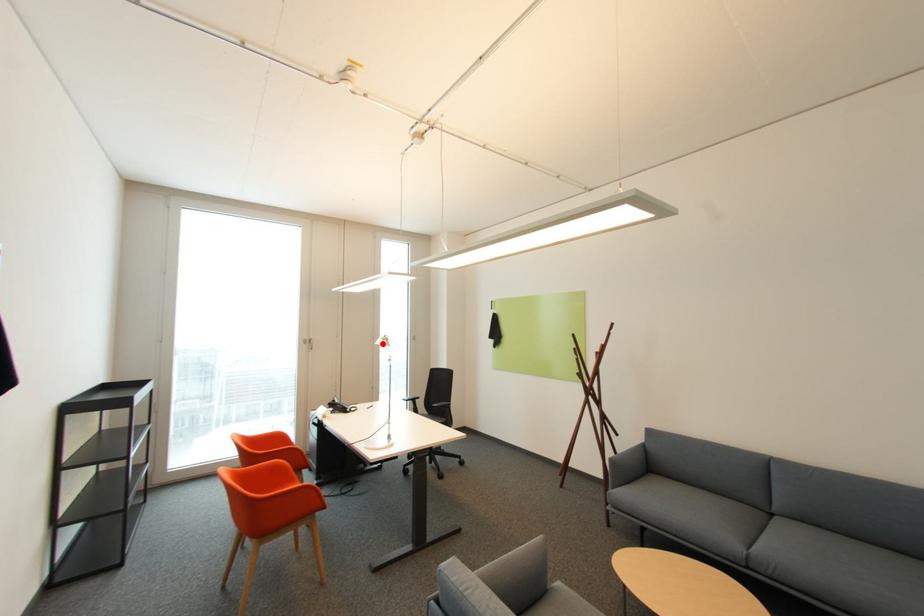
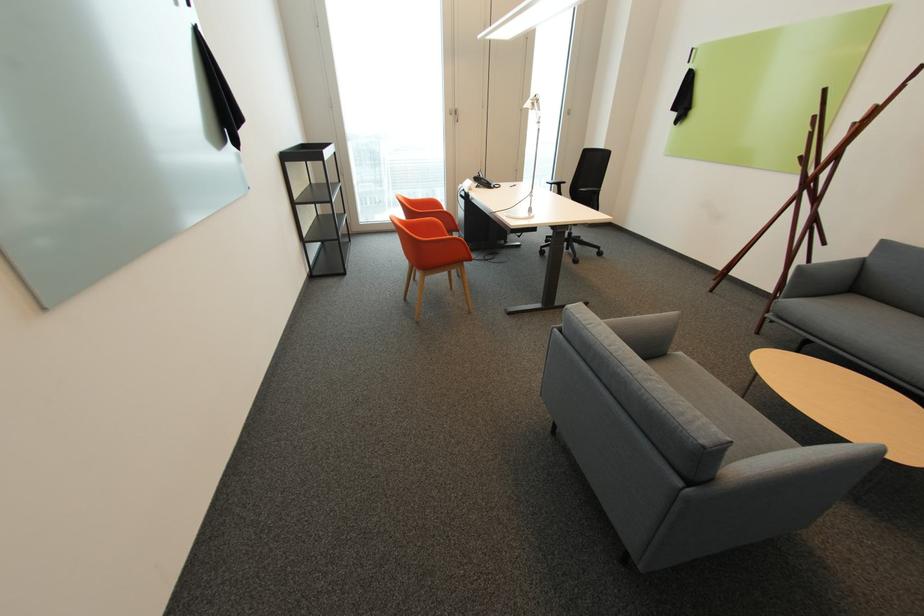
In the second image, find the point that corresponds to the highlighted location in the first image.

(531, 107)